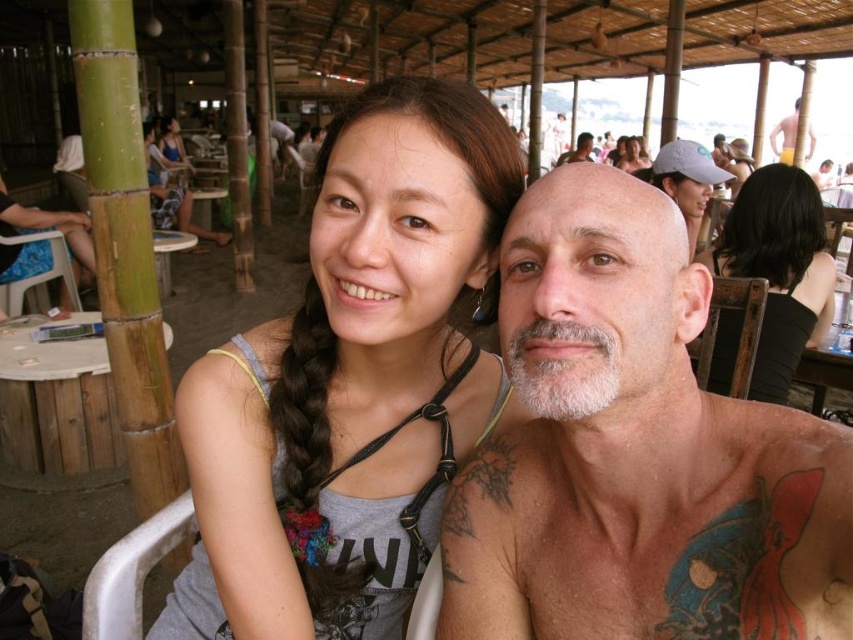
Consider the image. You are designing a seating arrangement for a photo shoot and need to place a large umbrella between the matte blue tank top at upper left and the bald head at center. Which object should the umbrella be placed closer to to ensure it covers both adequately?

The umbrella should be placed closer to the bald head at center because the matte blue tank top at upper left is larger in size and would require more coverage, but since the bald head is smaller, positioning the umbrella closer to it would balance the coverage between both objects.

You are a photographer taking a photo of the matte blue tank top at upper left and the matte black hair at upper center. Which object will appear closer to the camera in the final photo?

The matte blue tank top at upper left will appear closer to the camera in the final photo because it is further to the viewer than the matte black hair at upper center.